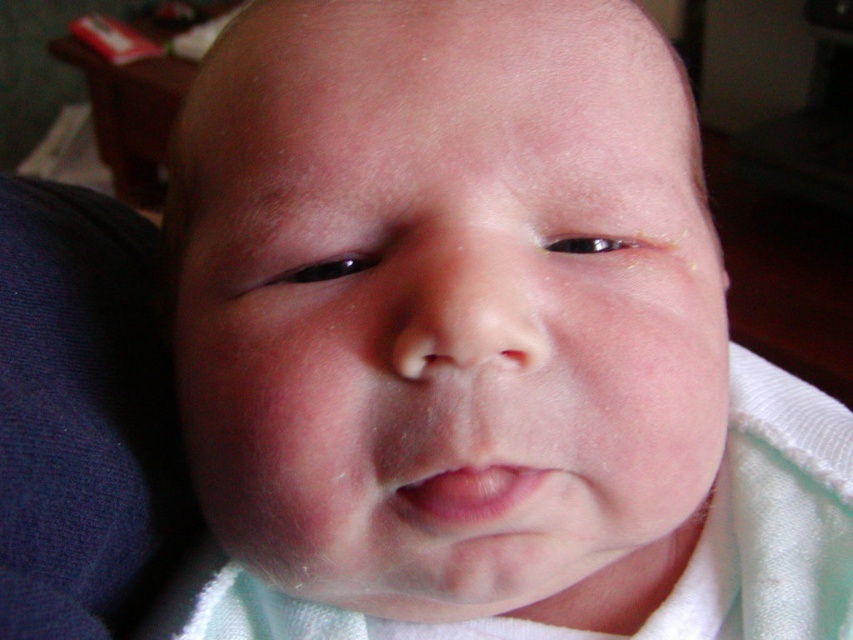
Can you confirm if smooth skin baby at center is positioned below pink smooth lips at center?

Incorrect, smooth skin baby at center is not positioned below pink smooth lips at center.

In the scene shown: Measure the distance between smooth skin baby at center and pink smooth lips at center.

They are 3.12 inches apart.

This screenshot has width=853, height=640. In order to click on smooth skin baby at center in this screenshot , I will do `click(448, 301)`.